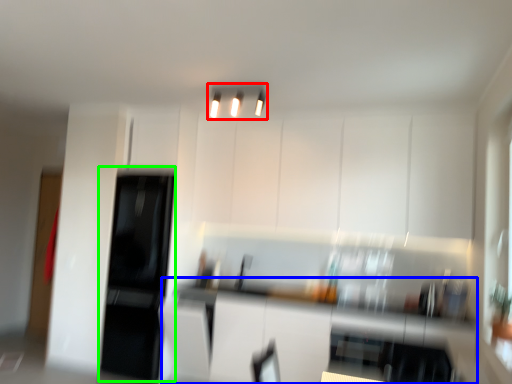
Question: Estimate the real-world distances between objects in this image. Which object is closer to light fixture (highlighted by a red box), counter top (highlighted by a blue box) or appliance (highlighted by a green box)?

Choices:
 (A) counter top
 (B) appliance

Answer: (A)